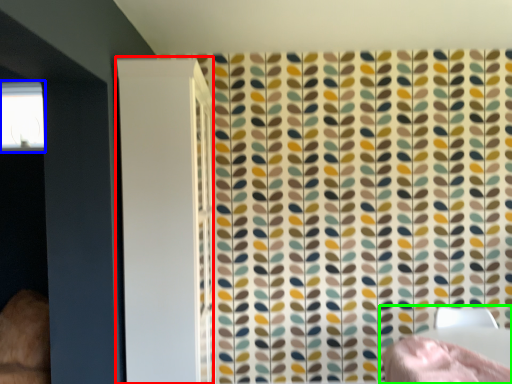
Question: Which is farther away from screen door (highlighted by a red box)? window (highlighted by a blue box) or bed (highlighted by a green box)?

Choices:
 (A) window
 (B) bed

Answer: (A)